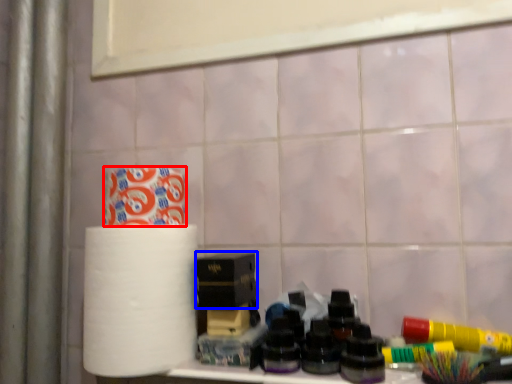
Question: Among these objects, which one is farthest to the camera, toilet paper (highlighted by a red box) or box (highlighted by a blue box)?

Choices:
 (A) toilet paper
 (B) box

Answer: (B)